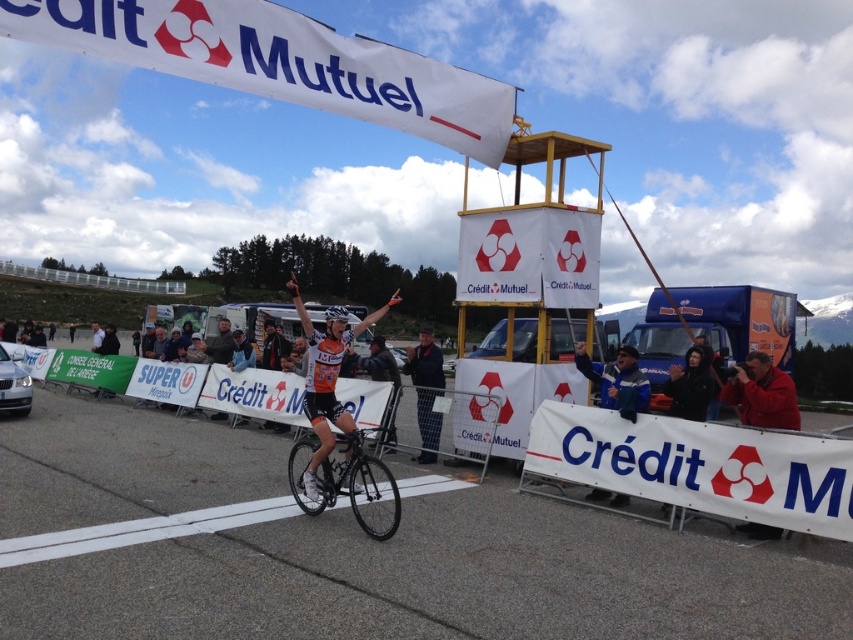
You are a photographer at the finish line and want to capture a clear shot of both the shiny black bicycle at center and the black leather jacket at upper center. However, the bicycle is blocking part of the jacket. To ensure both are fully visible in your photo, should you move the camera closer or farther away from the subjects?

The shiny black bicycle at center is in front of the black leather jacket at upper center. To ensure both are fully visible, you should move the camera farther away from the subjects. This will create more depth and allow the jacket behind the bicycle to come into view without obstruction.

You are a photographer positioned at the finish line. You want to capture a photo where both the shiny black bicycle at center and the orange jersey at center are clearly visible. Which object should you focus on to ensure both are in sharp focus?

The shiny black bicycle at center is closer to the viewer than the orange jersey at center. To ensure both are in sharp focus, focus on the shiny black bicycle at center, as it is the closer object, and the orange jersey at center will fall within the depth of field.